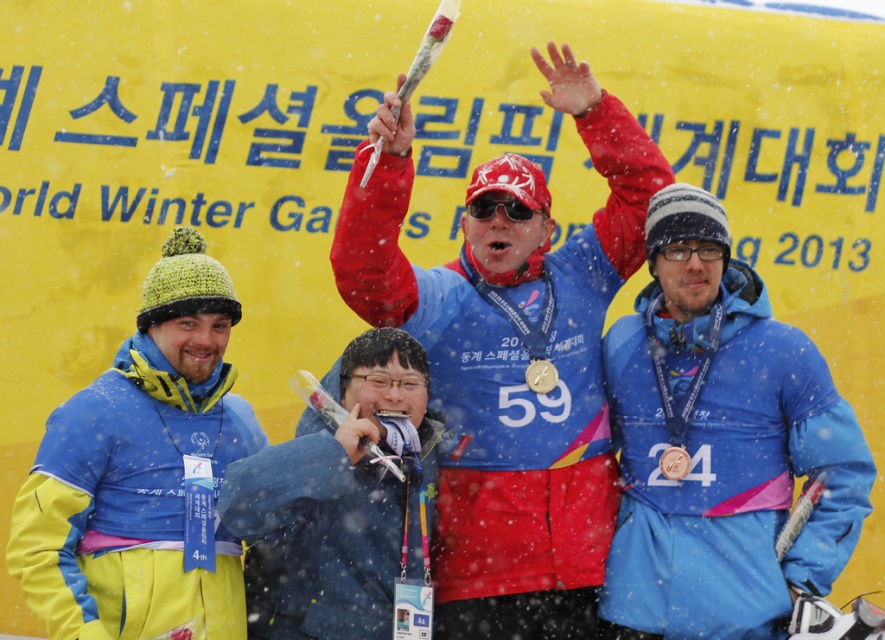
Does blue synthetic jacket at center appear on the left side of yellow fleece jacket at left?

In fact, blue synthetic jacket at center is to the right of yellow fleece jacket at left.

Is point (639, 333) positioned after point (199, 403)?

Yes, point (639, 333) is behind point (199, 403).

You are a GUI agent. You are given a task and a screenshot of the screen. Output one action in this format:
    pyautogui.click(x=<x>, y=<y>)
    Task: Click on the blue synthetic jacket at center
    
    Given the screenshot: What is the action you would take?
    pyautogui.click(x=720, y=444)

Is yellow fleece jacket at left thinner than blue fabric jacket at center?

No, yellow fleece jacket at left is not thinner than blue fabric jacket at center.

Is point (149, 273) positioned before point (370, 429)?

No, it is not.

Find the location of a particular element. yellow fleece jacket at left is located at coordinates (143, 474).

Which is more to the right, blue fabric jacket at center or gold metallic medal at center?

gold metallic medal at center is more to the right.

Is point (308, 461) positioned after point (525, 369)?

No, (308, 461) is in front of (525, 369).

Between point (308, 464) and point (552, 376), which one is positioned behind?

The point (552, 376) is more distant.

Identify the location of blue fabric jacket at center. (336, 500).